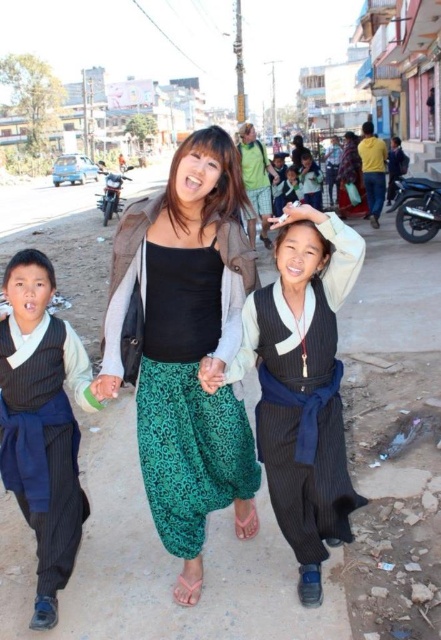
Question: Which of the following is the closest to the observer?

Choices:
 (A) (284, 204)
 (B) (333, 512)
 (C) (145, 387)
 (D) (56, 321)

Answer: (B)

Question: Does green printed fabric pants at center appear on the left side of dark blue fabric pants at center?

Choices:
 (A) yes
 (B) no

Answer: (A)

Question: Which point is farther to the camera?

Choices:
 (A) black pinstriped vest at center
 (B) dark blue striped vest at left
 (C) black pinstriped dress at center
 (D) green fabric hand at center

Answer: (C)

Question: Is black pinstriped dress at center in front of green printed fabric pants at center?

Choices:
 (A) no
 (B) yes

Answer: (B)

Question: Based on their relative distances, which object is nearer to the dark blue striped vest at left?

Choices:
 (A) green printed fabric pants at center
 (B) dark blue fabric pants at center
 (C) green fabric hand at center

Answer: (C)

Question: Does green printed fabric pants at center have a lesser width compared to dark blue fabric pants at center?

Choices:
 (A) yes
 (B) no

Answer: (A)